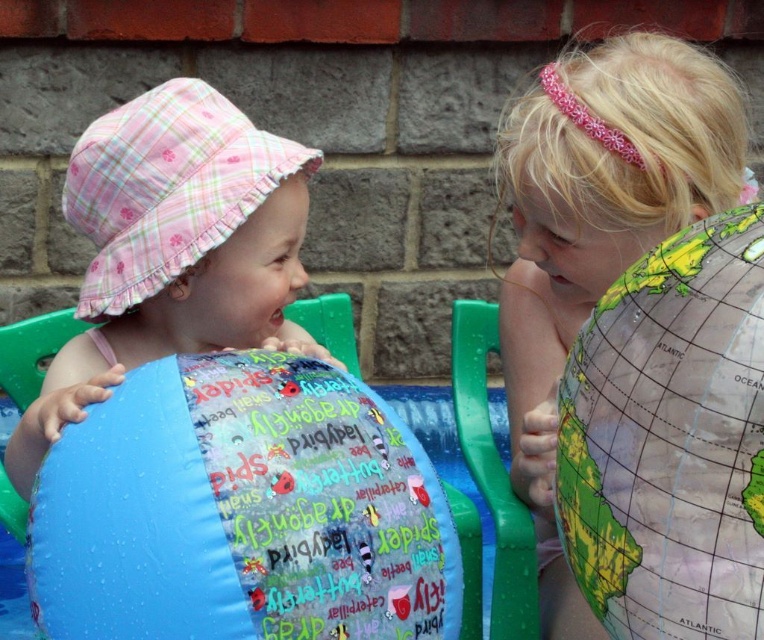
Which is in front, point (627, 502) or point (170, 122)?

Positioned in front is point (627, 502).

Between point (753, 609) and point (138, 340), which one is positioned in front?

Positioned in front is point (753, 609).

You are a GUI agent. You are given a task and a screenshot of the screen. Output one action in this format:
    pyautogui.click(x=<x>, y=<y>)
    Task: Click on the transparent plastic globe at right
    
    Given the screenshot: What is the action you would take?
    pyautogui.click(x=669, y=440)

Who is more forward, (280, 465) or (591, 500)?

Point (591, 500) is more forward.

Consider the image. Who is more distant from viewer, (63, 452) or (613, 621)?

Point (63, 452)

Locate an element on the screen. The height and width of the screenshot is (640, 764). blue rubber beach ball at left is located at coordinates (241, 512).

Who is more distant from viewer, (361, 561) or (251, 198)?

Positioned behind is point (251, 198).

Based on the photo, does blue rubber beach ball at left have a lesser height compared to pink plaid hat at left?

Yes, blue rubber beach ball at left is shorter than pink plaid hat at left.

Image resolution: width=764 pixels, height=640 pixels. What do you see at coordinates (241, 512) in the screenshot? I see `blue rubber beach ball at left` at bounding box center [241, 512].

Locate an element on the screen. Image resolution: width=764 pixels, height=640 pixels. blue rubber beach ball at left is located at coordinates (241, 512).